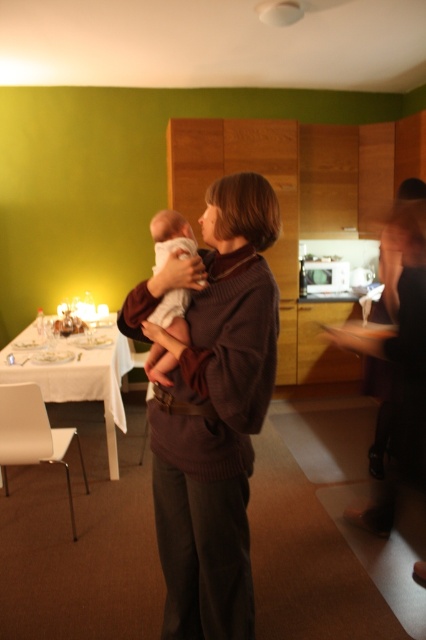
Question: Among these objects, which one is farthest from the camera?

Choices:
 (A) white soft baby at center
 (B) white cloth table at left

Answer: (B)

Question: Does white cloth table at left appear over white soft baby at center?

Choices:
 (A) yes
 (B) no

Answer: (B)

Question: Can you confirm if white cloth table at left is positioned to the left of white soft baby at center?

Choices:
 (A) no
 (B) yes

Answer: (B)

Question: Which of these objects is positioned closest to the white cloth table at left?

Choices:
 (A) brown sweater at center
 (B) white soft baby at center

Answer: (B)

Question: Can you confirm if brown sweater at center is positioned above white cloth table at left?

Choices:
 (A) no
 (B) yes

Answer: (B)

Question: Estimate the real-world distances between objects in this image. Which object is closer to the brown sweater at center?

Choices:
 (A) white soft baby at center
 (B) white cloth table at left

Answer: (A)